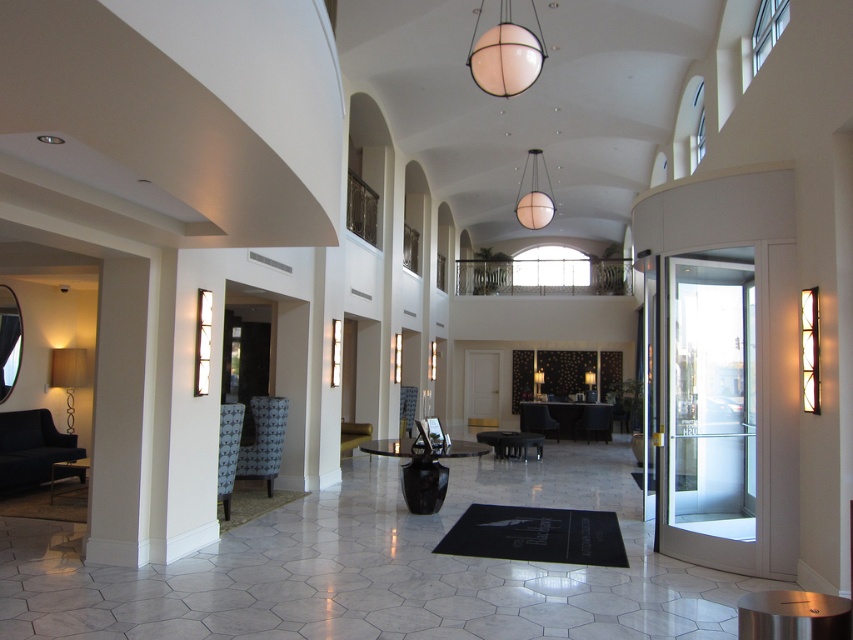
Question: Estimate the real-world distances between objects in this image. Which object is farther from the patterned fabric armchair at lower left?

Choices:
 (A) matte gold lamp at left
 (B) white matte sphere at upper center

Answer: (B)

Question: Can you confirm if white matte globe at upper center is thinner than patterned fabric armchair at left?

Choices:
 (A) yes
 (B) no

Answer: (B)

Question: Is white matte sphere at upper center closer to camera compared to matte black chair at center?

Choices:
 (A) no
 (B) yes

Answer: (B)

Question: Which point is closer to the camera?

Choices:
 (A) (606, 406)
 (B) (547, 408)
 (C) (242, 452)

Answer: (C)

Question: Which of the following is the closest to the observer?

Choices:
 (A) (67, 417)
 (B) (537, 168)
 (C) (534, 17)
 (D) (219, 486)

Answer: (D)

Question: Is white matte globe at upper center below white matte sphere at upper center?

Choices:
 (A) yes
 (B) no

Answer: (B)